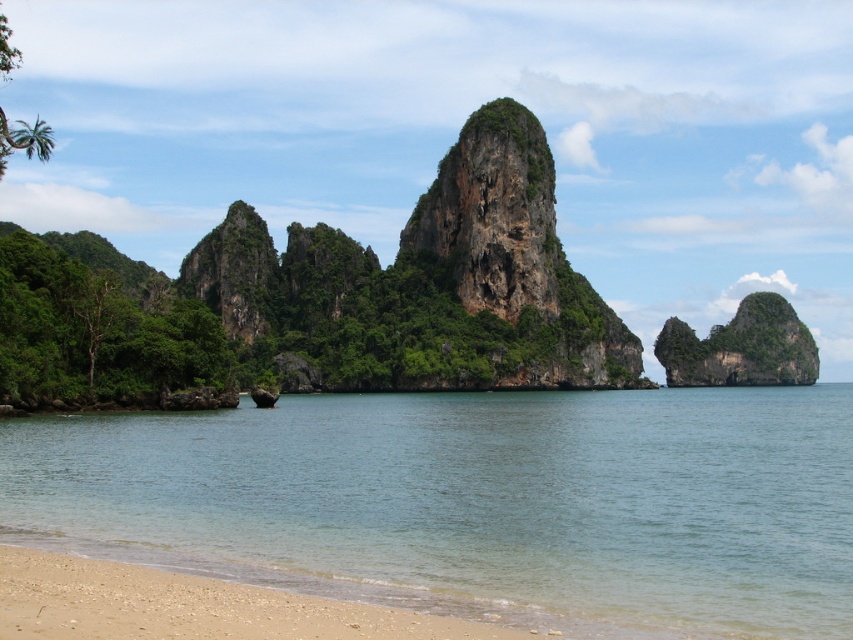
Question: Which object is closer to the camera taking this photo?

Choices:
 (A) light brown gravel at lower left
 (B) clear water at lower left

Answer: (A)

Question: Among these objects, which one is farthest from the camera?

Choices:
 (A) light brown gravel at lower left
 (B) clear water at lower left

Answer: (B)

Question: Among these objects, which one is farthest from the camera?

Choices:
 (A) light brown gravel at lower left
 (B) clear water at lower left

Answer: (B)

Question: Does clear water at lower left appear on the right side of light brown gravel at lower left?

Choices:
 (A) yes
 (B) no

Answer: (A)

Question: Is clear water at lower left thinner than light brown gravel at lower left?

Choices:
 (A) no
 (B) yes

Answer: (A)

Question: Does clear water at lower left have a larger size compared to light brown gravel at lower left?

Choices:
 (A) no
 (B) yes

Answer: (B)